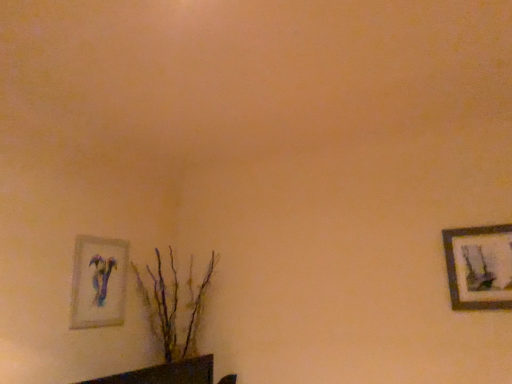
Question: From a real-world perspective, is brown textured plant at lower left physically located above or below wooden framed artwork at right, which is counted as the first picture frame, starting from the right?

Choices:
 (A) above
 (B) below

Answer: (B)

Question: Considering the relative positions of brown textured plant at lower left and wooden framed artwork at right, which is the 2th picture frame from left to right, in the image provided, is brown textured plant at lower left to the left or to the right of wooden framed artwork at right, which is the 2th picture frame from left to right,?

Choices:
 (A) left
 (B) right

Answer: (A)

Question: Which object is the closest to the wooden framed artwork at right, which is counted as the first picture frame, starting from the right?

Choices:
 (A) brown textured plant at lower left
 (B) matte glass picture frame at lower left, the second picture frame viewed from the right

Answer: (A)

Question: Which of these objects is positioned farthest from the matte glass picture frame at lower left, placed as the first picture frame when sorted from left to right?

Choices:
 (A) wooden framed artwork at right, which is the 2th picture frame from left to right
 (B) brown textured plant at lower left

Answer: (A)